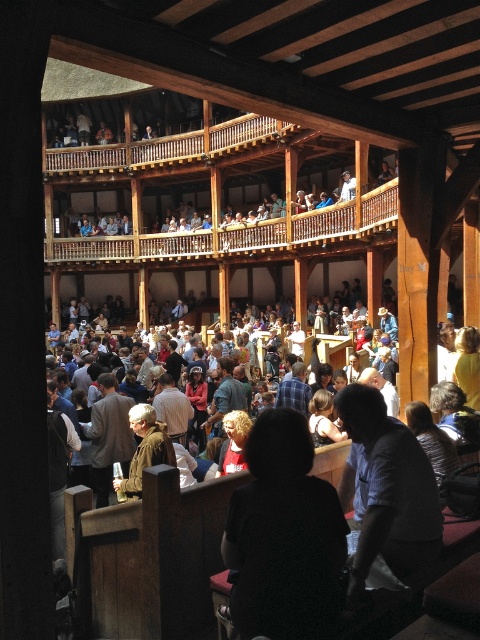
Question: Which point is closer to the camera?

Choices:
 (A) dark brown hair at center
 (B) plaid shirt at center
 (C) blue shirt at lower right

Answer: (A)

Question: Considering the relative positions of dark brown hair at center and brown leather jacket at lower left in the image provided, where is dark brown hair at center located with respect to brown leather jacket at lower left?

Choices:
 (A) right
 (B) left

Answer: (A)

Question: Which point appears farthest from the camera in this image?

Choices:
 (A) (92, 468)
 (B) (121, 486)

Answer: (A)

Question: Which object is positioned closest to the blue shirt at lower right?

Choices:
 (A) brown leather jacket at lower left
 (B) leather jacket at center

Answer: (B)

Question: Does dark brown hair at center have a smaller size compared to plaid shirt at center?

Choices:
 (A) no
 (B) yes

Answer: (A)

Question: Where is dark brown hair at center located in relation to leather jacket at center in the image?

Choices:
 (A) right
 (B) left

Answer: (A)